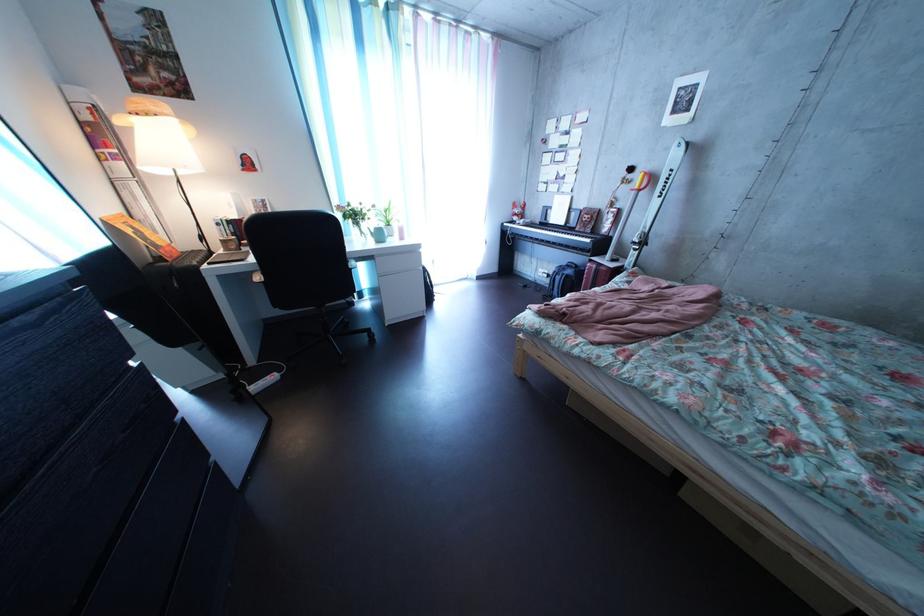
The width and height of the screenshot is (924, 616). What are the coordinates of `white drawer handle` in the screenshot? It's located at (402, 270).